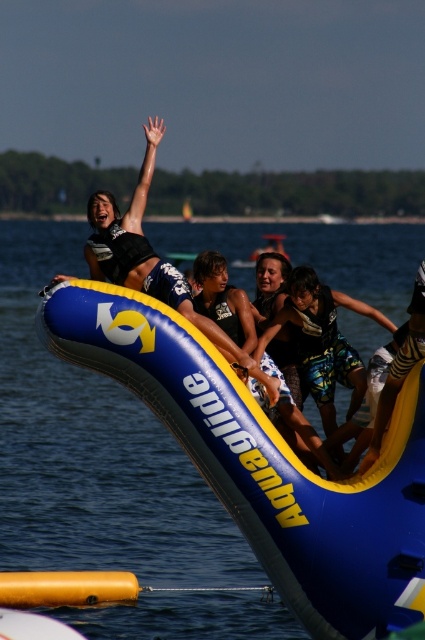
Question: Which point is farther to the camera?

Choices:
 (A) blue and white wetsuit at center
 (B) blue inflatable boat at center

Answer: (A)

Question: Does blue inflatable boat at center have a larger size compared to blue and white wetsuit at center?

Choices:
 (A) yes
 (B) no

Answer: (A)

Question: Which point is farther from the camera taking this photo?

Choices:
 (A) (184, 392)
 (B) (295, 266)

Answer: (B)

Question: Does blue inflatable boat at center have a larger size compared to blue and white wetsuit at center?

Choices:
 (A) yes
 (B) no

Answer: (A)

Question: Can you confirm if blue inflatable boat at center is bigger than blue and white wetsuit at center?

Choices:
 (A) no
 (B) yes

Answer: (B)